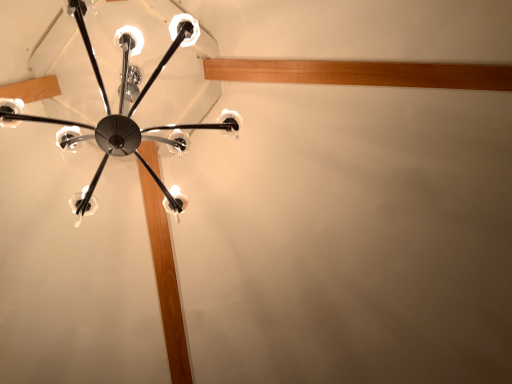
Measure the distance between chrome/metallic ceiling fan at upper left and camera.

chrome/metallic ceiling fan at upper left is 4.09 feet from camera.

Describe the element at coordinates (123, 108) in the screenshot. I see `chrome/metallic ceiling fan at upper left` at that location.

This screenshot has width=512, height=384. What are the coordinates of `chrome/metallic ceiling fan at upper left` in the screenshot? It's located at tap(123, 108).

In order to click on chrome/metallic ceiling fan at upper left in this screenshot , I will do `click(123, 108)`.